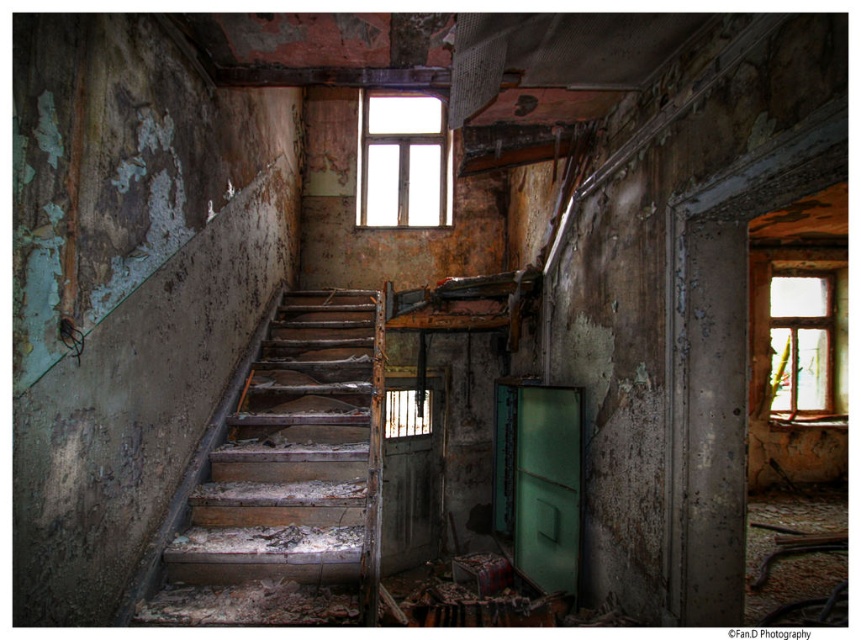
Question: Based on their relative distances, which object is nearer to the white glass window at upper center?

Choices:
 (A) transparent glass window at upper right
 (B) wooden stairs at center
 (C) rusty wooden door at center
 (D) green matte door at center-right

Answer: (C)

Question: Which object is closer to the camera taking this photo?

Choices:
 (A) white glass window at upper center
 (B) transparent glass window at upper right
 (C) green matte door at center-right
 (D) wooden stairs at center

Answer: (D)

Question: From the image, what is the correct spatial relationship of wooden stairs at center in relation to rusty wooden door at center?

Choices:
 (A) right
 (B) left

Answer: (B)

Question: Is wooden stairs at center bigger than rusty wooden door at center?

Choices:
 (A) yes
 (B) no

Answer: (A)

Question: Is the position of green matte door at center-right more distant than that of transparent glass window at upper right?

Choices:
 (A) yes
 (B) no

Answer: (B)

Question: Which point is farther from the camera taking this photo?

Choices:
 (A) (358, 461)
 (B) (428, 205)
 (C) (420, 544)

Answer: (B)